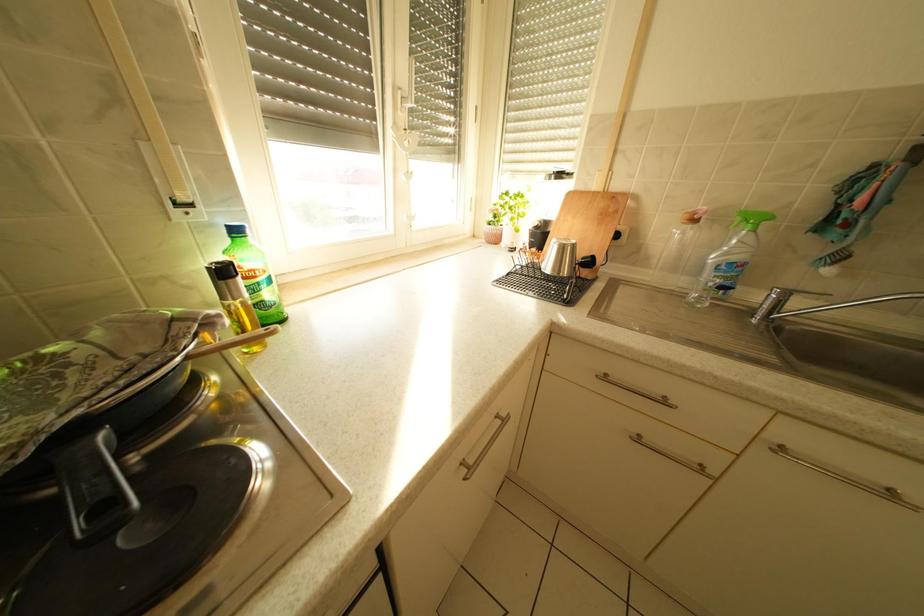
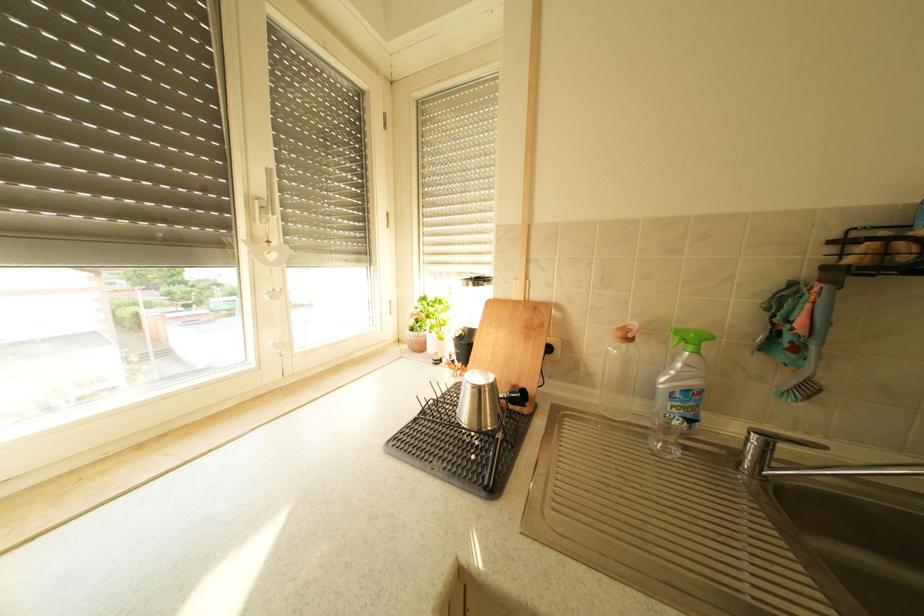
What movement of the cameraman would produce the second image?

The movement direction of the cameraman is right, forward.